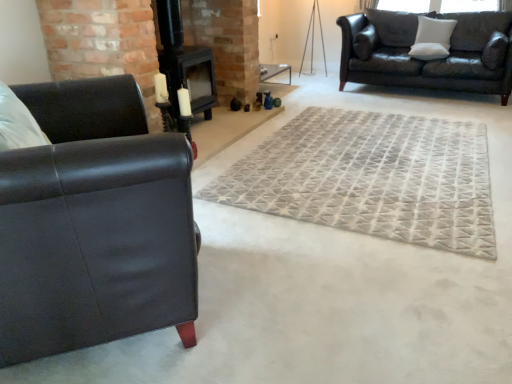
Question: From the image's perspective, is white soft pillow at upper right, placed as the second pillow when sorted from left to right, over gray textured rug at center?

Choices:
 (A) yes
 (B) no

Answer: (A)

Question: From a real-world perspective, is white soft pillow at upper right, placed as the second pillow when sorted from left to right, located beneath gray textured rug at center?

Choices:
 (A) yes
 (B) no

Answer: (B)

Question: Does white soft pillow at upper right, positioned as the first pillow in right-to-left order, have a larger size compared to gray textured rug at center?

Choices:
 (A) yes
 (B) no

Answer: (B)

Question: Could gray textured rug at center be considered to be inside white soft pillow at upper right, placed as the second pillow when sorted from left to right?

Choices:
 (A) no
 (B) yes

Answer: (A)

Question: Is white soft pillow at upper right, placed as the second pillow when sorted from left to right, with gray textured rug at center?

Choices:
 (A) yes
 (B) no

Answer: (B)

Question: Is gray textured rug at center spatially inside white soft cushion at upper right, acting as the second pillow starting from the right, or outside of it?

Choices:
 (A) inside
 (B) outside

Answer: (B)

Question: From a real-world perspective, is gray textured rug at center physically located above or below white soft cushion at upper right, which is counted as the first pillow, starting from the left?

Choices:
 (A) above
 (B) below

Answer: (B)

Question: Considering their positions, is gray textured rug at center located in front of or behind white soft cushion at upper right, acting as the second pillow starting from the right?

Choices:
 (A) behind
 (B) front

Answer: (B)

Question: In terms of size, does gray textured rug at center appear bigger or smaller than white soft cushion at upper right, acting as the second pillow starting from the right?

Choices:
 (A) small
 (B) big

Answer: (B)

Question: Does point (504, 36) appear closer or farther from the camera than point (423, 54)?

Choices:
 (A) closer
 (B) farther

Answer: (A)

Question: Is white soft pillow at upper right, positioned as the first pillow in right-to-left order, inside or outside of white soft cushion at upper right, which is counted as the first pillow, starting from the left?

Choices:
 (A) inside
 (B) outside

Answer: (B)

Question: In terms of size, does white soft pillow at upper right, positioned as the first pillow in right-to-left order, appear bigger or smaller than white soft cushion at upper right, which is counted as the first pillow, starting from the left?

Choices:
 (A) small
 (B) big

Answer: (B)

Question: Considering the positions of white soft pillow at upper right, placed as the second pillow when sorted from left to right, and white soft cushion at upper right, acting as the second pillow starting from the right, in the image, is white soft pillow at upper right, placed as the second pillow when sorted from left to right, taller or shorter than white soft cushion at upper right, acting as the second pillow starting from the right,?

Choices:
 (A) tall
 (B) short

Answer: (B)

Question: Considering the positions of matte black couch at upper right, the second studio couch positioned from the left, and white soft pillow at upper right, positioned as the first pillow in right-to-left order, in the image, is matte black couch at upper right, the second studio couch positioned from the left, wider or thinner than white soft pillow at upper right, positioned as the first pillow in right-to-left order,?

Choices:
 (A) thin
 (B) wide

Answer: (B)

Question: Looking at the image, does matte black couch at upper right, the 1th studio couch positioned from the top, seem bigger or smaller compared to white soft pillow at upper right, positioned as the first pillow in right-to-left order?

Choices:
 (A) big
 (B) small

Answer: (A)